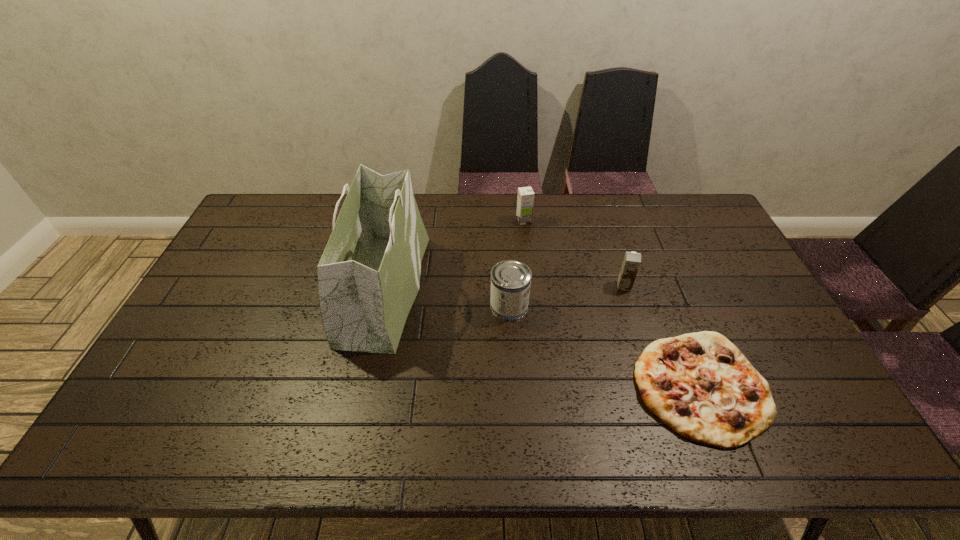
At what (x,y) coordinates should I click in order to perform the action: click on vacant area between the tallest object and the farther chocolate milk. Please return your answer as a coordinate pair (x, y). The width and height of the screenshot is (960, 540). Looking at the image, I should click on (454, 255).

The image size is (960, 540). I want to click on object that can be found as the third closest to the leftmost object, so click(x=700, y=385).

The height and width of the screenshot is (540, 960). Identify the location of the second closest object to the farthest object. (510, 280).

At what (x,y) coordinates should I click in order to perform the action: click on vacant space that satisfies the following two spatial constraints: 1. on the back side of the can; 2. on the right side of the farther chocolate milk. Please return your answer as a coordinate pair (x, y). The image size is (960, 540). Looking at the image, I should click on (504, 221).